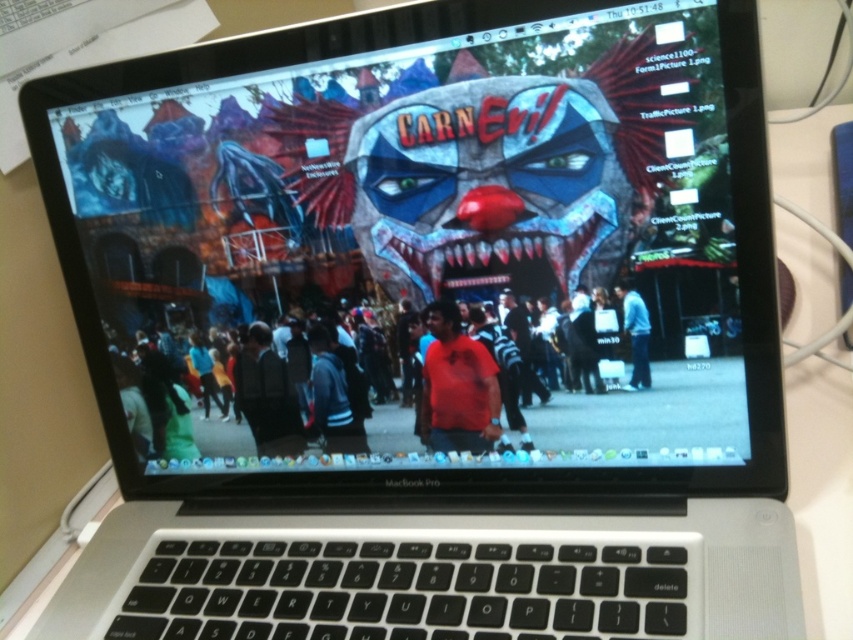
Question: Estimate the real-world distances between objects in this image. Which object is farther from the red shirt at center?

Choices:
 (A) blue denim jeans at center
 (B) matte red shirt at center

Answer: (A)

Question: From the image, what is the correct spatial relationship of red shirt at center in relation to blue denim jeans at center?

Choices:
 (A) below
 (B) above

Answer: (B)

Question: Is red shirt at center behind blue denim jeans at center?

Choices:
 (A) no
 (B) yes

Answer: (A)

Question: Which of the following is the farthest from the observer?

Choices:
 (A) blue denim jeans at center
 (B) matte red shirt at center

Answer: (B)

Question: Which point is closer to the camera?

Choices:
 (A) blue denim jeans at center
 (B) red shirt at center
 (C) matte red shirt at center

Answer: (B)

Question: Does red shirt at center have a larger size compared to matte red shirt at center?

Choices:
 (A) no
 (B) yes

Answer: (B)